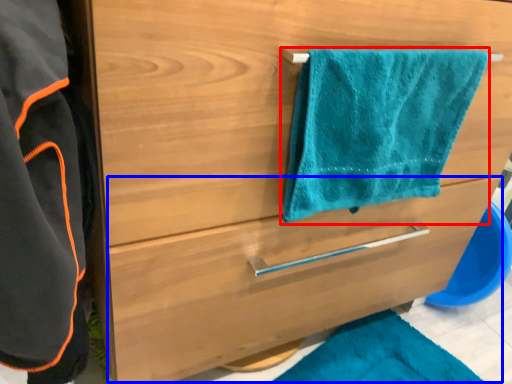
Question: Which object is further to the camera taking this photo, towel/napkin (highlighted by a red box) or drawer (highlighted by a blue box)?

Choices:
 (A) towel/napkin
 (B) drawer

Answer: (B)